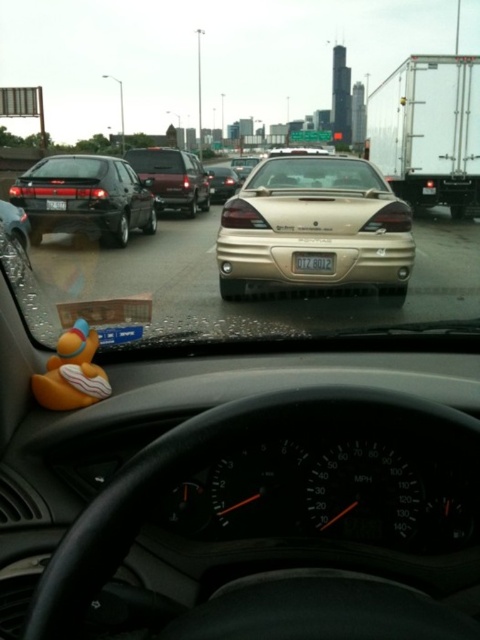
Question: Based on their relative distances, which object is nearer to the satin dark red sedan at center?

Choices:
 (A) gold metallic license plate at center
 (B) orange rubber duck at lower left

Answer: (A)

Question: Does gold glossy sedan at center have a larger size compared to clear glass windshield at center?

Choices:
 (A) yes
 (B) no

Answer: (B)

Question: Is gold metallic license plate at center wider than gold metallic sedan at center?

Choices:
 (A) no
 (B) yes

Answer: (A)

Question: Which object is the closest to the gold metallic sedan at center?

Choices:
 (A) gold metallic license plate at center
 (B) orange rubber duck at lower left
 (C) satin dark red sedan at center

Answer: (C)

Question: Does gold glossy sedan at center appear on the right side of white plastic license plate at center?

Choices:
 (A) yes
 (B) no

Answer: (A)

Question: Which point is closer to the camera?

Choices:
 (A) (222, 196)
 (B) (191, 205)
 (C) (323, 252)
 (D) (348, 180)

Answer: (C)